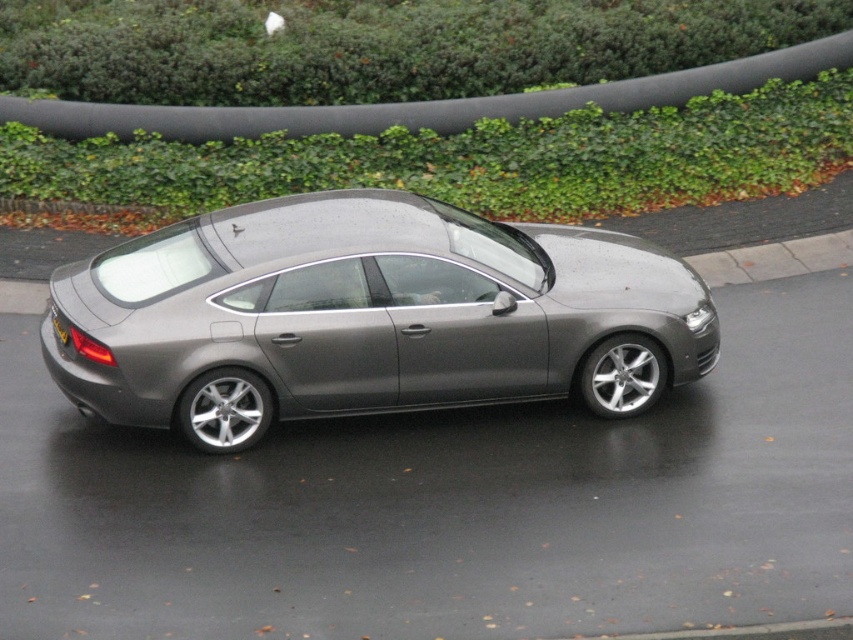
Can you confirm if satin metallic car at center is positioned to the right of yellow plastic license plate at rear?

Correct, you'll find satin metallic car at center to the right of yellow plastic license plate at rear.

Where is `satin metallic car at center`? Image resolution: width=853 pixels, height=640 pixels. satin metallic car at center is located at coordinates (368, 316).